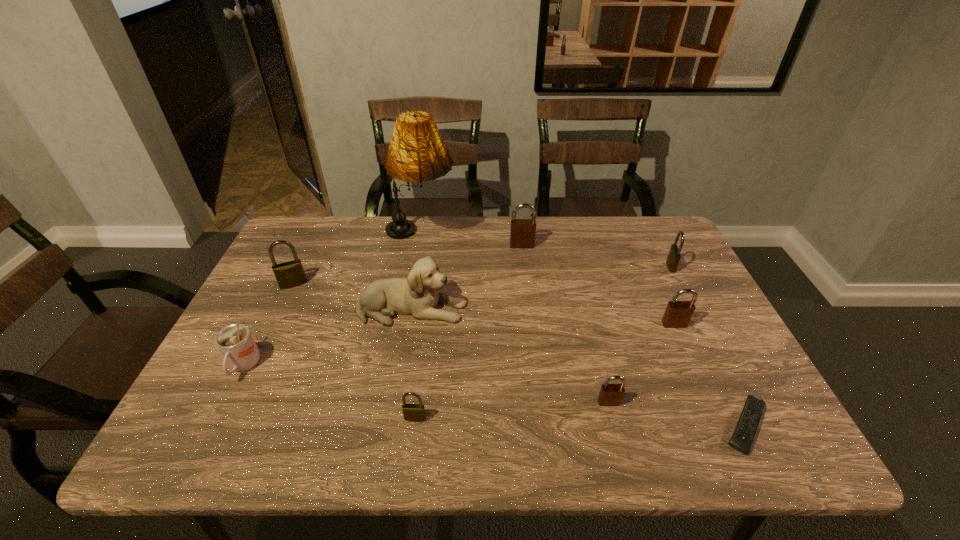
Image resolution: width=960 pixels, height=540 pixels. I want to click on free space located on the front-facing side of the fourth farthest padlock, so click(x=707, y=396).

Locate an element on the screen. The width and height of the screenshot is (960, 540). vacant space located on the left of the rightmost brass padlock is located at coordinates (571, 266).

Where is `vacant region located 0.100m on the side with the handle of the cup`? This screenshot has width=960, height=540. vacant region located 0.100m on the side with the handle of the cup is located at coordinates (213, 428).

The height and width of the screenshot is (540, 960). Identify the location of free space located 0.150m on the right of the smallest brass padlock. (498, 418).

The width and height of the screenshot is (960, 540). I want to click on vacant space located 0.060m on the front-facing side of the smallest brown padlock, so click(616, 432).

Locate an element on the screen. This screenshot has height=540, width=960. vacant space located on the left of the remote control is located at coordinates (620, 425).

At what (x,y) coordinates should I click in order to perform the action: click on lampshade that is at the far edge. Please return your answer as a coordinate pair (x, y). Looking at the image, I should click on (417, 153).

Where is `padlock located in the near edge section of the desktop`? padlock located in the near edge section of the desktop is located at coordinates (412, 412).

At what (x,y) coordinates should I click in order to perform the action: click on remote control present at the near edge. Please return your answer as a coordinate pair (x, y). Looking at the image, I should click on (744, 434).

Where is `padlock present at the left edge`? This screenshot has width=960, height=540. padlock present at the left edge is located at coordinates (290, 274).